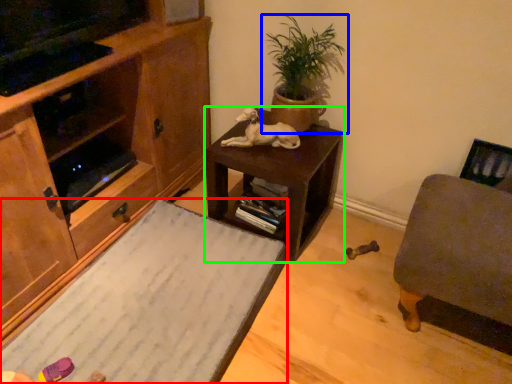
Question: Which object is the farthest from desk (highlighted by a red box)? Choose among these: houseplant (highlighted by a blue box) or table (highlighted by a green box).

Choices:
 (A) houseplant
 (B) table

Answer: (A)